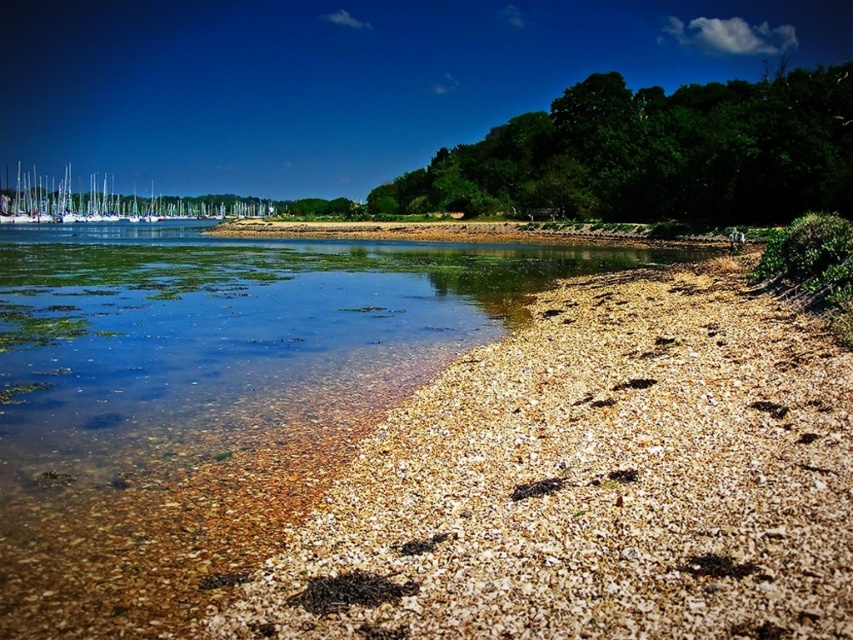
Question: Can you confirm if green leafy trees at upper right is positioned below white glossy boats at upper left?

Choices:
 (A) yes
 (B) no

Answer: (B)

Question: Does brown gravelly sand at lower left have a smaller size compared to white glossy boats at upper left?

Choices:
 (A) no
 (B) yes

Answer: (B)

Question: Which object is farther from the camera taking this photo?

Choices:
 (A) white glossy boats at upper left
 (B) green leafy trees at upper right

Answer: (A)

Question: Which object is farther from the camera taking this photo?

Choices:
 (A) green leafy trees at upper right
 (B) brown gravelly sand at lower left
 (C) white glossy boats at upper left

Answer: (C)

Question: Does green leafy trees at upper right have a smaller size compared to white glossy boats at upper left?

Choices:
 (A) yes
 (B) no

Answer: (B)

Question: Considering the real-world distances, which object is farthest from the brown gravelly sand at lower left?

Choices:
 (A) white glossy boats at upper left
 (B) green leafy trees at upper right

Answer: (A)